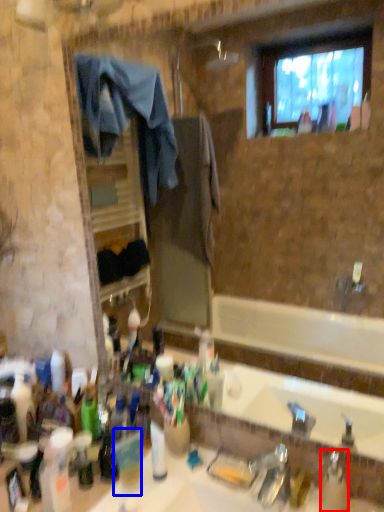
Question: Which object appears farthest to the camera in this image, bottle (highlighted by a red box) or coffee cup (highlighted by a blue box)?

Choices:
 (A) bottle
 (B) coffee cup

Answer: (B)